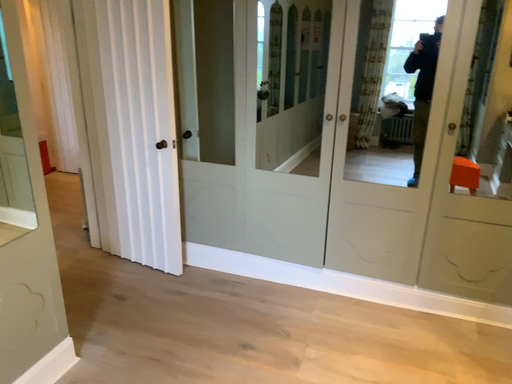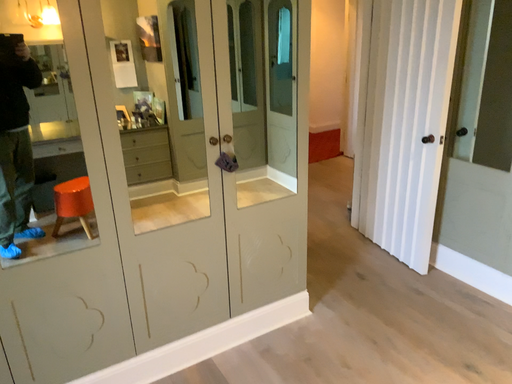
Question: How did the camera likely rotate when shooting the video?

Choices:
 (A) rotated left
 (B) rotated right

Answer: (A)